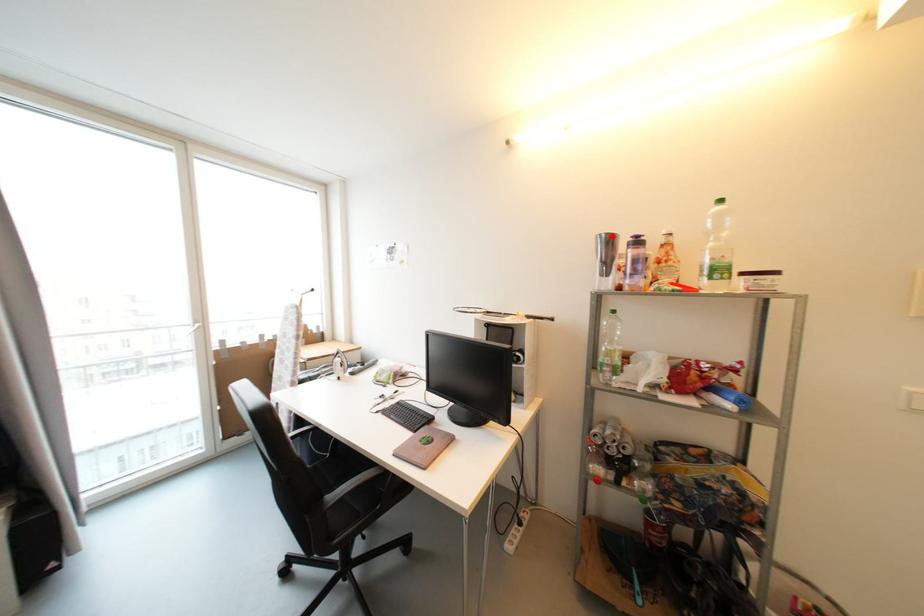
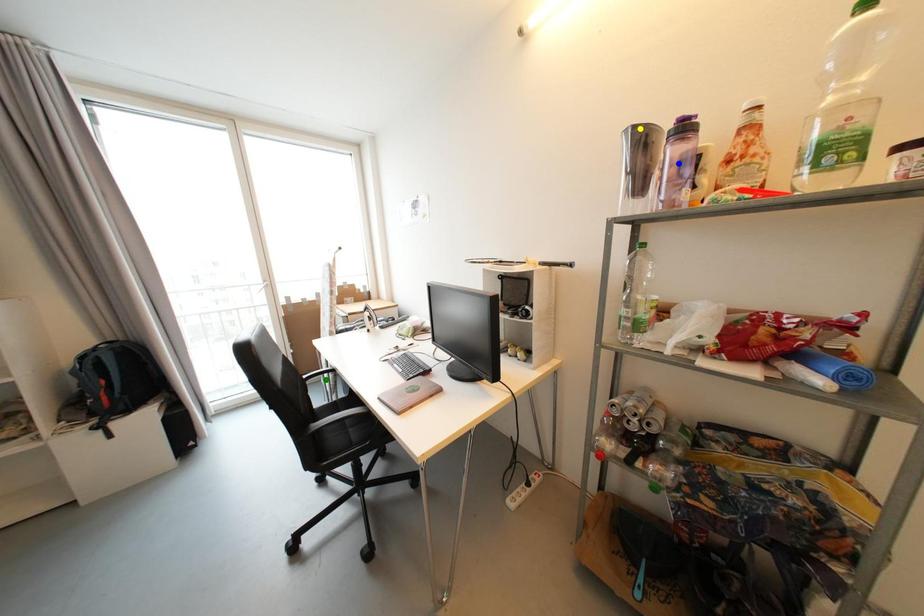
Question: I am providing you with two images of the same scene from different viewpoints. A red point is marked on the first image. You are given multiple points on the second image. Which point in image 2 represents the same 3d spot as the red point in image 1?

Choices:
 (A) green point
 (B) yellow point
 (C) blue point

Answer: (B)